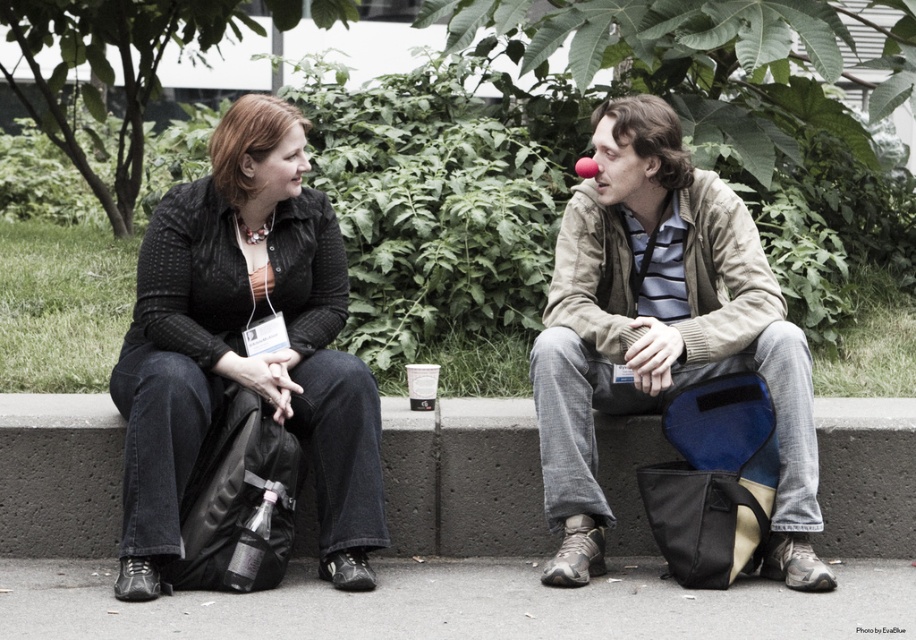
From the picture: Does matte black sweater at center have a smaller size compared to light beige jacket at center?

No.

Between matte black sweater at center and light beige jacket at center, which one is positioned lower?

light beige jacket at center

Does point (266, 301) come behind point (551, 333)?

Yes.

Find the location of a particular element. The height and width of the screenshot is (640, 916). matte black sweater at center is located at coordinates (243, 348).

Consider the image. Between matte black jacket at center and matte black sweater at center, which one appears on the right side from the viewer's perspective?

Positioned to the right is matte black jacket at center.

The height and width of the screenshot is (640, 916). What do you see at coordinates (662, 330) in the screenshot?
I see `matte black jacket at center` at bounding box center [662, 330].

Locate an element on the screen. matte black jacket at center is located at coordinates (662, 330).

From the picture: Does matte black jacket at center have a greater height compared to light beige jacket at center?

In fact, matte black jacket at center may be shorter than light beige jacket at center.

What do you see at coordinates (662, 330) in the screenshot?
I see `matte black jacket at center` at bounding box center [662, 330].

Find the location of a particular element. matte black jacket at center is located at coordinates (662, 330).